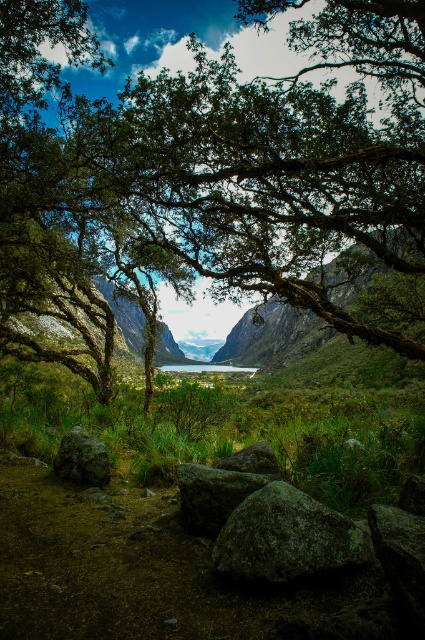
You are a hiker standing at the edge of the rocky cliff at center. You want to move to the gray rough boulder at lower center. Is the boulder blocking your path or is it in front of you?

The gray rough boulder at lower center is in front of the rocky cliff at center, so it is in front of you and blocking your path.

You are a hiker standing at the base of the gray rough boulder at lower center and want to reach the rocky cliff at center. Which direction should you move to get there?

The gray rough boulder at lower center is below the rocky cliff at center, so you should move upward to reach the rocky cliff at center from the gray rough boulder at lower center.

You are a hiker planning to climb the rocky cliff at center and the gray rough rock at center. Which one do you think will require more effort due to its height?

The rocky cliff at center will require more effort because it has a greater height compared to the gray rough rock at center.